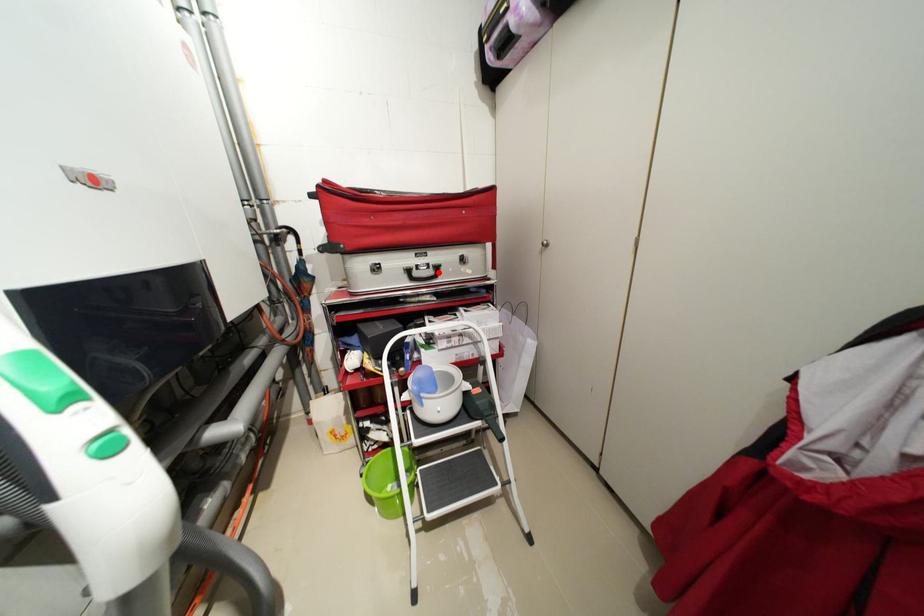
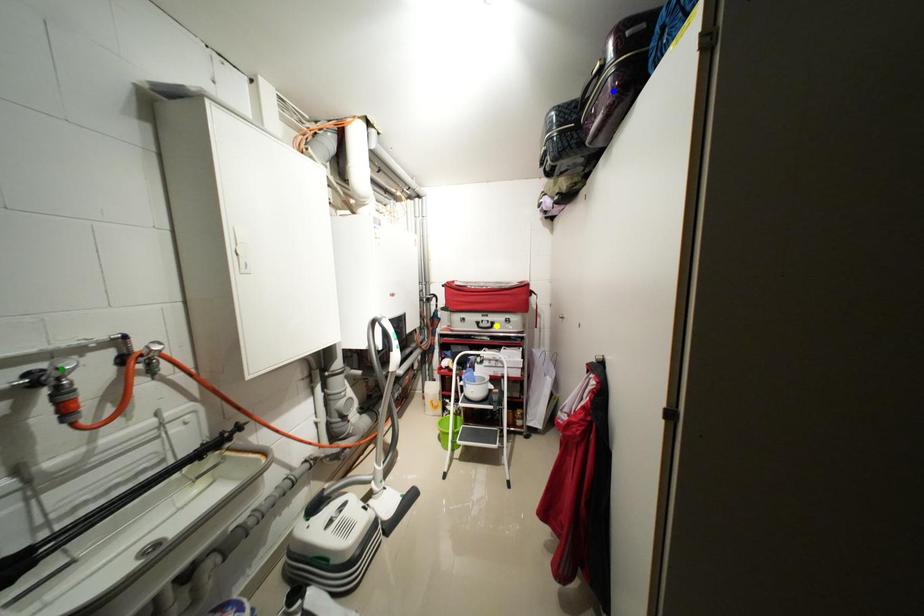
Question: I am providing you with two images of the same scene from different viewpoints. A red point is marked on the first image. You are given multiple points on the second image. Can you choose the point in image 2 that corresponds to the point in image 1?

Choices:
 (A) yellow point
 (B) blue point
 (C) green point

Answer: (A)